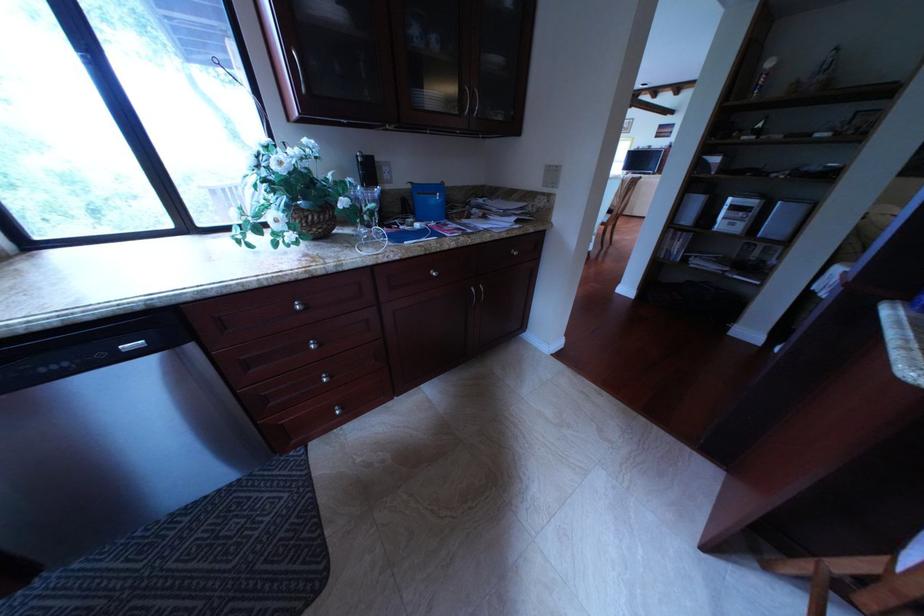
Find where to turn the window crank handle. Please return your answer as a coordinate pair (x, y).

(90, 62)